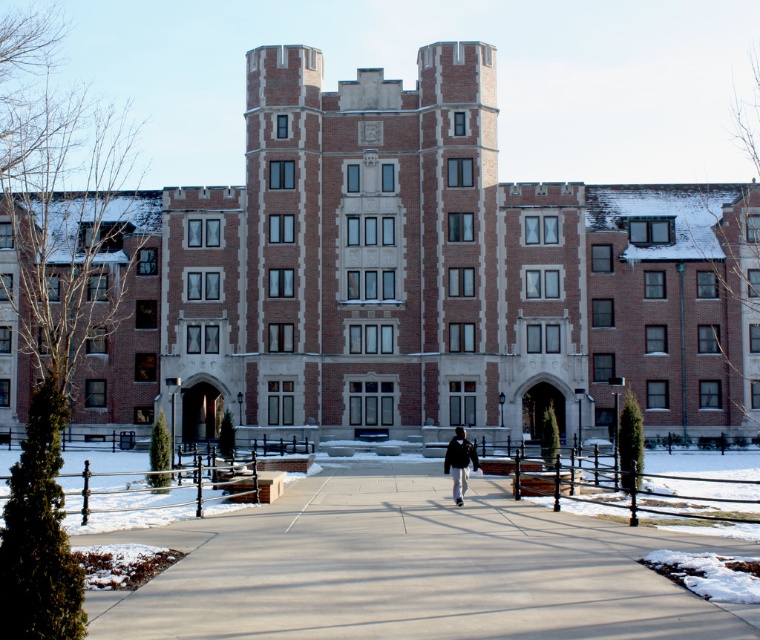
Is concrete at center closer to the viewer compared to black matte jacket at center?

Yes, it is in front of black matte jacket at center.

Can you confirm if concrete at center is positioned above black matte jacket at center?

Actually, concrete at center is below black matte jacket at center.

This screenshot has width=760, height=640. What do you see at coordinates (409, 570) in the screenshot?
I see `concrete at center` at bounding box center [409, 570].

The height and width of the screenshot is (640, 760). I want to click on concrete at center, so click(x=409, y=570).